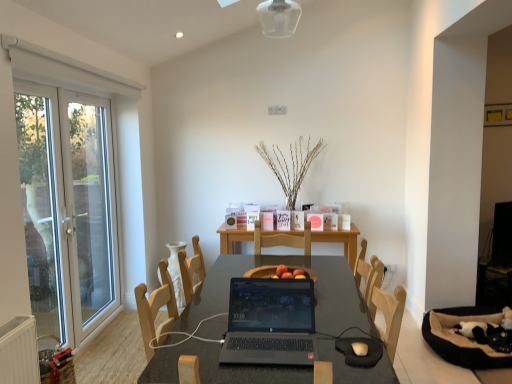
Measure the distance between point (95, 199) and camera.

4.00 meters.

Image resolution: width=512 pixels, height=384 pixels. What do you see at coordinates (360, 348) in the screenshot?
I see `matte white mouse at center` at bounding box center [360, 348].

Where is `black glossy table at center`? black glossy table at center is located at coordinates (287, 264).

The image size is (512, 384). What do you see at coordinates (41, 205) in the screenshot? I see `white glass screen door at left, the first screen door positioned from the front` at bounding box center [41, 205].

The width and height of the screenshot is (512, 384). Find the location of `white glass screen door at left, the second screen door from the front`. white glass screen door at left, the second screen door from the front is located at coordinates tap(89, 209).

Does matte white mouse at center turn towards white glass screen door at left, positioned as the 1th screen door in back-to-front order?

No, matte white mouse at center is not turned towards white glass screen door at left, positioned as the 1th screen door in back-to-front order.

Which is more to the right, matte white mouse at center or white glass screen door at left, positioned as the 1th screen door in back-to-front order?

matte white mouse at center is more to the right.

From the image's perspective, does matte white mouse at center appear higher than white glass screen door at left, the second screen door from the front?

No, from the image's perspective, matte white mouse at center is not above white glass screen door at left, the second screen door from the front.

How different are the orientations of matte white mouse at center and white glass screen door at left, positioned as the 1th screen door in back-to-front order, in degrees?

matte white mouse at center and white glass screen door at left, positioned as the 1th screen door in back-to-front order, are facing 87.6 degrees away from each other.

Is black matte laptop at center thinner than white glass screen door at left, positioned as the 1th screen door in back-to-front order?

No, black matte laptop at center is not thinner than white glass screen door at left, positioned as the 1th screen door in back-to-front order.

Is black matte laptop at center looking in the opposite direction of white glass screen door at left, positioned as the 1th screen door in back-to-front order?

That's not correct — black matte laptop at center is not looking away from white glass screen door at left, positioned as the 1th screen door in back-to-front order.

In terms of height, does black matte laptop at center look taller or shorter compared to white glass screen door at left, the second screen door from the front?

Considering their sizes, black matte laptop at center has less height than white glass screen door at left, the second screen door from the front.

Which is more to the left, white glass screen door at left, which is the second screen door in back-to-front order, or black glossy table at center?

Positioned to the left is white glass screen door at left, which is the second screen door in back-to-front order.

Considering the relative sizes of white glass screen door at left, the first screen door positioned from the front, and black glossy table at center in the image provided, is white glass screen door at left, the first screen door positioned from the front, bigger than black glossy table at center?

No, white glass screen door at left, the first screen door positioned from the front, is not bigger than black glossy table at center.

Is white glass screen door at left, which is the second screen door in back-to-front order, in contact with black glossy table at center?

No, white glass screen door at left, which is the second screen door in back-to-front order, is not beside black glossy table at center.

Is white glass screen door at left, the first screen door positioned from the front, taller than black glossy table at center?

Correct, white glass screen door at left, the first screen door positioned from the front, is much taller as black glossy table at center.

Is the surface of black glossy table at center in direct contact with matte white mouse at center?

black glossy table at center and matte white mouse at center are clearly separated.

Which is closer, [228,264] or [359,353]?

Point [228,264] is farther from the camera than point [359,353].

Considering the positions of objects white glass screen door at left, positioned as the 1th screen door in back-to-front order, and black glossy table at center in the image provided, who is behind, white glass screen door at left, positioned as the 1th screen door in back-to-front order, or black glossy table at center?

white glass screen door at left, positioned as the 1th screen door in back-to-front order, is behind.

From a real-world perspective, is white glass screen door at left, positioned as the 1th screen door in back-to-front order, above or below black glossy table at center?

white glass screen door at left, positioned as the 1th screen door in back-to-front order, is situated higher than black glossy table at center in the real world.

Between white glass screen door at left, positioned as the 1th screen door in back-to-front order, and black glossy table at center, which one has more height?

white glass screen door at left, positioned as the 1th screen door in back-to-front order, is taller.

Between black glossy table at center and white glass screen door at left, the first screen door positioned from the front, which one has smaller width?

Thinner between the two is white glass screen door at left, the first screen door positioned from the front.

Which object is further away from the camera taking this photo, black glossy table at center or white glass screen door at left, the first screen door positioned from the front?

white glass screen door at left, the first screen door positioned from the front, is further from the camera.

Is white glass screen door at left, which is the second screen door in back-to-front order, surrounded by black glossy table at center?

No, white glass screen door at left, which is the second screen door in back-to-front order, is not a part of black glossy table at center.

Considering the positions of objects black glossy table at center and white glass screen door at left, the first screen door positioned from the front, in the image provided, who is more to the right, black glossy table at center or white glass screen door at left, the first screen door positioned from the front,?

black glossy table at center is more to the right.

Is matte white mouse at center in front of or behind white glass screen door at left, which is the second screen door in back-to-front order, in the image?

In the image, matte white mouse at center appears in front of white glass screen door at left, which is the second screen door in back-to-front order.

How much distance is there between matte white mouse at center and white glass screen door at left, the first screen door positioned from the front?

2.89 meters.

From the image's perspective, is matte white mouse at center located above or below white glass screen door at left, which is the second screen door in back-to-front order?

Based on their image positions, matte white mouse at center is located beneath white glass screen door at left, which is the second screen door in back-to-front order.

From a real-world perspective, between matte white mouse at center and white glass screen door at left, the first screen door positioned from the front, who is vertically lower?

In real-world perspective, matte white mouse at center is lower.

In order to click on mouse below the white glass screen door at left, positioned as the 1th screen door in back-to-front order (from a real-world perspective) in this screenshot , I will do `click(360, 348)`.

Locate an element on the screen. The height and width of the screenshot is (384, 512). laptop that appears on the right of white glass screen door at left, positioned as the 1th screen door in back-to-front order is located at coordinates (270, 322).

Considering their positions, is white glass door at left positioned closer to black glossy table at center than matte white mouse at center?

Among the two, matte white mouse at center is located nearer to black glossy table at center.

When comparing their distances from white glass screen door at left, the first screen door positioned from the front, does black matte laptop at center or white glass door at left seem further?

black matte laptop at center.

Based on the photo, which object lies nearer to the anchor point black matte laptop at center, white glass door at left or white glass screen door at left, positioned as the 1th screen door in back-to-front order?

white glass door at left.

Based on their spatial positions, is black glossy table at center or black matte laptop at center closer to white glass door at left?

Among the two, black glossy table at center is located nearer to white glass door at left.

In the scene shown: Considering their positions, is black glossy table at center positioned further to white glass screen door at left, the first screen door positioned from the front, than matte white mouse at center?

Among the two, matte white mouse at center is located further to white glass screen door at left, the first screen door positioned from the front.

Considering their positions, is white glass screen door at left, positioned as the 1th screen door in back-to-front order, positioned closer to matte white mouse at center than black matte laptop at center?

The object closer to matte white mouse at center is black matte laptop at center.

Looking at the image, which one is located further to black matte laptop at center, black glossy table at center or white glass screen door at left, the first screen door positioned from the front?

white glass screen door at left, the first screen door positioned from the front, is positioned further to the anchor black matte laptop at center.

From the image, which object appears to be farther from white glass screen door at left, positioned as the 1th screen door in back-to-front order, white glass door at left or matte white mouse at center?

Based on the image, matte white mouse at center appears to be further to white glass screen door at left, positioned as the 1th screen door in back-to-front order.

Identify the location of laptop situated between white glass screen door at left, which is the second screen door in back-to-front order, and matte white mouse at center from left to right. (270, 322).

This screenshot has width=512, height=384. I want to click on mouse between black matte laptop at center and black glossy table at center vertically, so click(x=360, y=348).

Find the location of a particular element. This screenshot has width=512, height=384. laptop positioned between black glossy table at center and white glass screen door at left, the second screen door from the front, from near to far is located at coordinates (270, 322).

Locate an element on the screen. The height and width of the screenshot is (384, 512). laptop situated between white glass door at left and black glossy table at center from left to right is located at coordinates (270, 322).